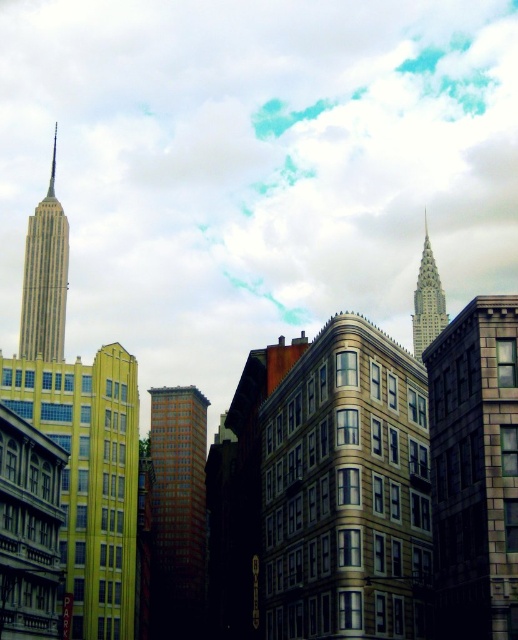
You are a drone operator trying to fly a drone through the gap between the red brick building at center and the shiny silver spire at upper right. Can you confirm if the drone can pass through the gap between them?

The red brick building at center is in front of the shiny silver spire at upper right, meaning there is no gap between them for the drone to pass through.

You are an architect analyzing the urban layout. You notice the red brick building at center and the shiny silver spire at upper right. Which of these two structures has a narrower width?

The red brick building at center has a lesser width compared to the shiny silver spire at upper right, so it is narrower.

You are a drone operator tasked with flying a drone between the red brick building at center and the shiny silver spire at upper right. The drone has a maximum flight distance of 80 meters. Can the drone safely travel between these two landmarks without exceeding its range?

The distance between the red brick building at center and the shiny silver spire at upper right is 77.50 meters, which is within the drone operator s 80 meter range. The drone can safely travel between them without exceeding its maximum flight distance.